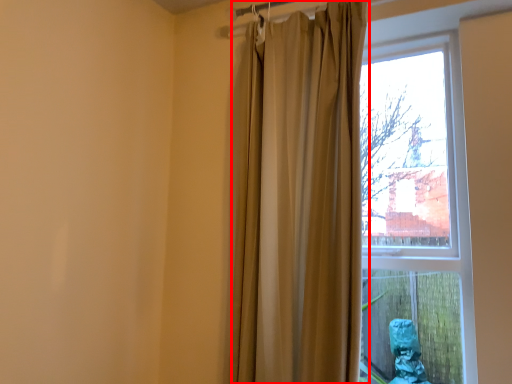
Question: From the image's perspective, where is curtain (annotated by the red box) located relative to window?

Choices:
 (A) above
 (B) below

Answer: (A)